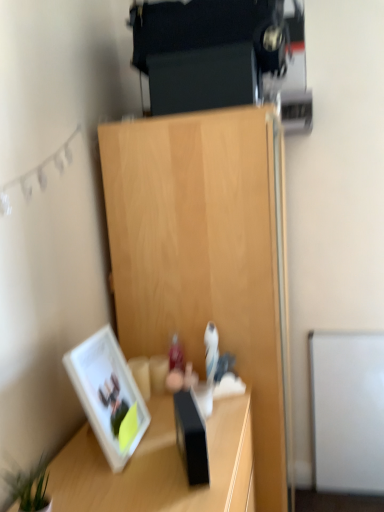
Question: Is green leafy plant at lower left at the right side of white glossy picture frame at lower left?

Choices:
 (A) no
 (B) yes

Answer: (A)

Question: From a real-world perspective, is green leafy plant at lower left positioned over white glossy picture frame at lower left based on gravity?

Choices:
 (A) no
 (B) yes

Answer: (A)

Question: Is white glossy picture frame at lower left surrounded by green leafy plant at lower left?

Choices:
 (A) yes
 (B) no

Answer: (B)

Question: From the image's perspective, is green leafy plant at lower left located beneath white glossy picture frame at lower left?

Choices:
 (A) no
 (B) yes

Answer: (B)

Question: Is green leafy plant at lower left positioned far away from white glossy picture frame at lower left?

Choices:
 (A) yes
 (B) no

Answer: (B)

Question: Is green leafy plant at lower left turned away from white glossy picture frame at lower left?

Choices:
 (A) yes
 (B) no

Answer: (B)

Question: Would you say white glossy picture frame at lower left contains light wood cabinet at center?

Choices:
 (A) yes
 (B) no

Answer: (B)

Question: Considering the relative sizes of white glossy picture frame at lower left and light wood cabinet at center in the image provided, is white glossy picture frame at lower left thinner than light wood cabinet at center?

Choices:
 (A) yes
 (B) no

Answer: (A)

Question: From the image's perspective, is white glossy picture frame at lower left beneath light wood cabinet at center?

Choices:
 (A) yes
 (B) no

Answer: (B)

Question: From the image's perspective, would you say white glossy picture frame at lower left is positioned over light wood cabinet at center?

Choices:
 (A) no
 (B) yes

Answer: (B)

Question: Considering the relative sizes of white glossy picture frame at lower left and light wood cabinet at center in the image provided, is white glossy picture frame at lower left smaller than light wood cabinet at center?

Choices:
 (A) no
 (B) yes

Answer: (B)

Question: Are white glossy picture frame at lower left and light wood cabinet at center beside each other?

Choices:
 (A) yes
 (B) no

Answer: (B)

Question: Is white glossy picture frame at lower left bigger than wooden desk at lower left?

Choices:
 (A) yes
 (B) no

Answer: (B)